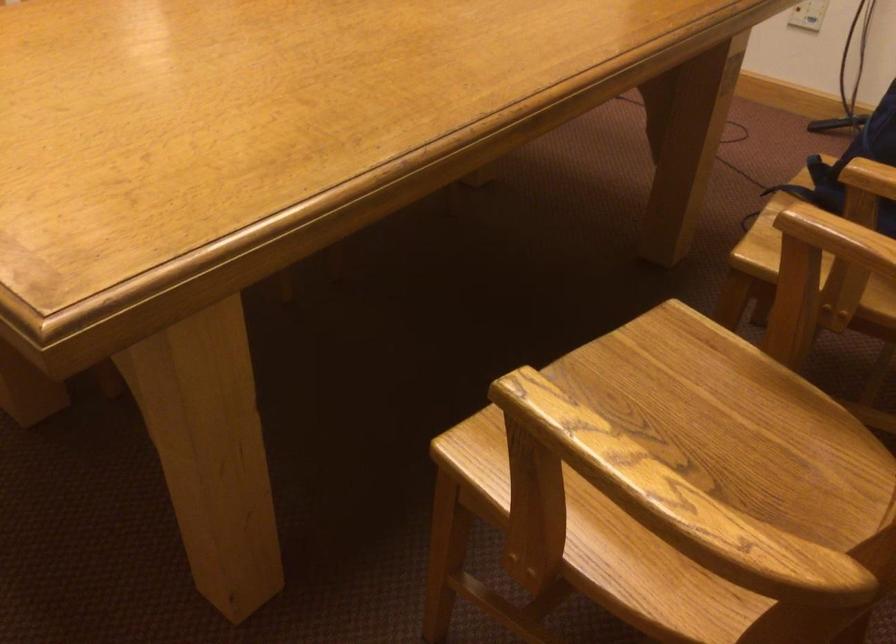
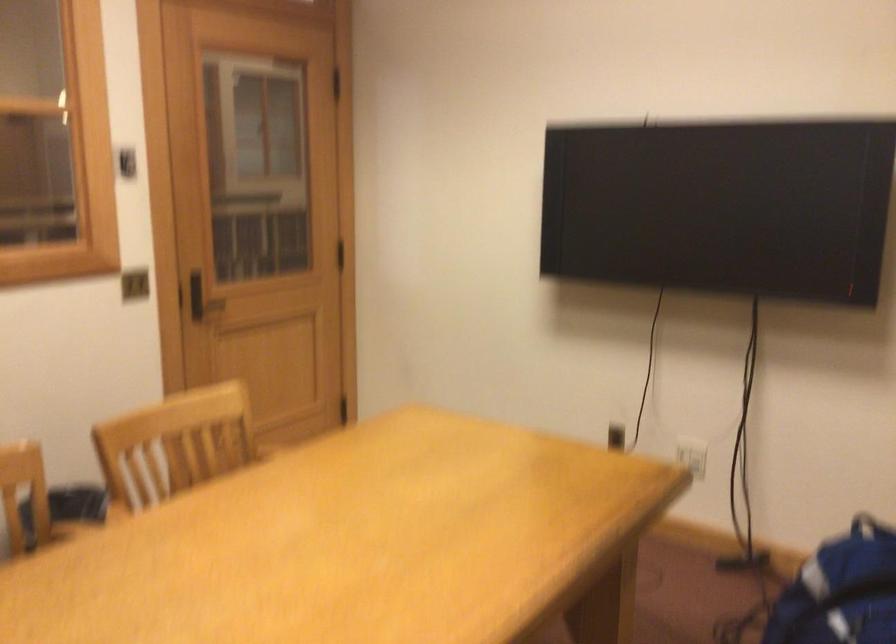
In a continuous first-person perspective shot, in which direction is the camera moving?

The movement direction of the cameraman is right, backward.